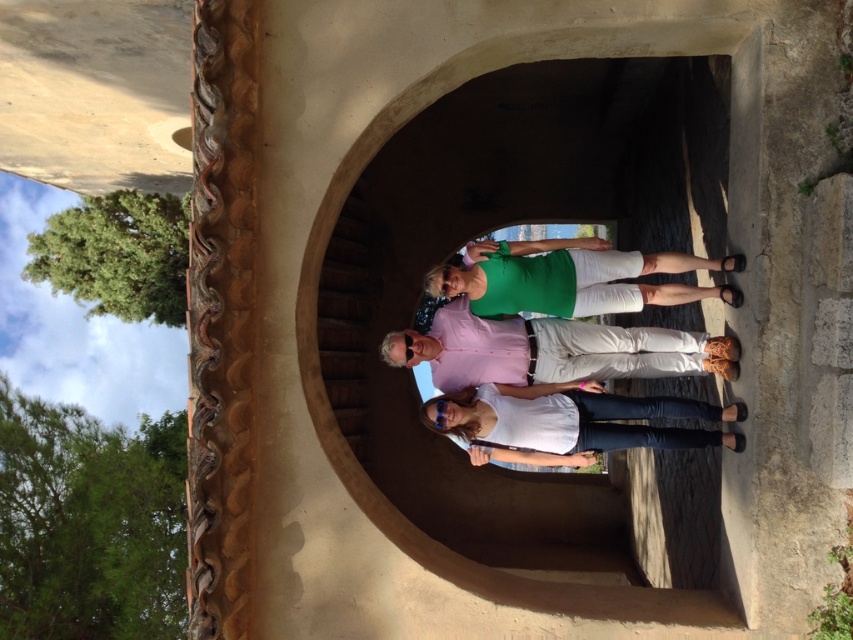
You are a photographer trying to capture a group photo. You notice the white matte shirt at center and the green matte shorts at center in the frame. Which object should you adjust to ensure both are fully visible in the photo?

The white matte shirt at center might be wider than the green matte shorts at center, so you should adjust the white matte shirt at center to ensure it fits within the frame.

You are taking a photo of the group under the archway. The white matte shirt at center and the green matte shorts at center are both in the frame. Which object appears taller in the photo?

The white matte shirt at center appears taller than the green matte shorts at center in the photo.

In the scene shown: You are standing at the center of the archway and want to take a photo of both the point at coordinates point (692,115) and point (675,337). Which point should you focus on first to ensure both are in the frame?

You should focus on point (675,337) first because it is closer to you than point (692,115), which is behind it. By centering the camera on the closer point, you can adjust the frame to include both points.